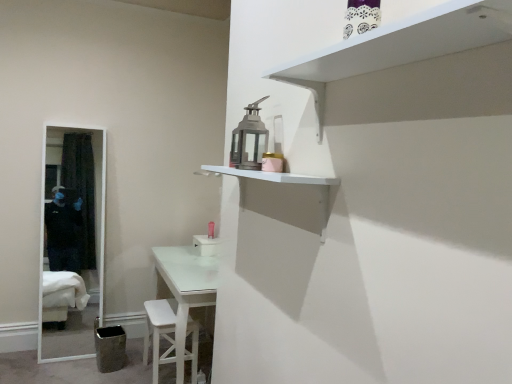
Question: Is pink matte toiletry at center inside the boundaries of white matte shelf at upper right, which is the 1th shelf in top-to-bottom order, or outside?

Choices:
 (A) outside
 (B) inside

Answer: (A)

Question: Considering the positions of pink matte toiletry at center and white matte shelf at upper right, which is the 1th shelf in top-to-bottom order, in the image, is pink matte toiletry at center wider or thinner than white matte shelf at upper right, which is the 1th shelf in top-to-bottom order,?

Choices:
 (A) thin
 (B) wide

Answer: (A)

Question: Estimate the real-world distances between objects in this image. Which object is farther from the pink matte toiletry at center?

Choices:
 (A) white matte shelf at upper right, which is the 1th shelf in top-to-bottom order
 (B) white wooden stool at lower center
 (C) white matte shelf at upper center, placed as the 1th shelf when sorted from bottom to top

Answer: (A)

Question: Considering the real-world distances, which object is farthest from the white wooden stool at lower center?

Choices:
 (A) white matte shelf at upper right, which is the 1th shelf in top-to-bottom order
 (B) white matte shelf at upper center, placed as the 1th shelf when sorted from bottom to top
 (C) pink matte toiletry at center

Answer: (A)